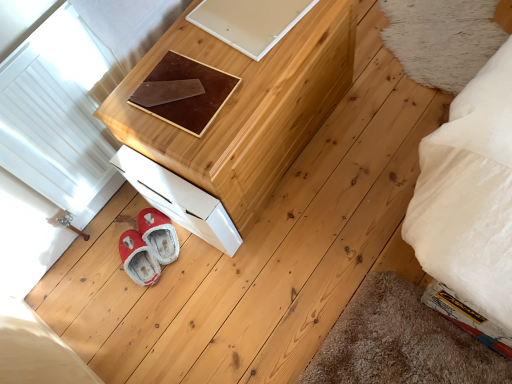
Identify the location of blank space situated above natural wood chest of drawers at upper center (from a real-world perspective). (215, 57).